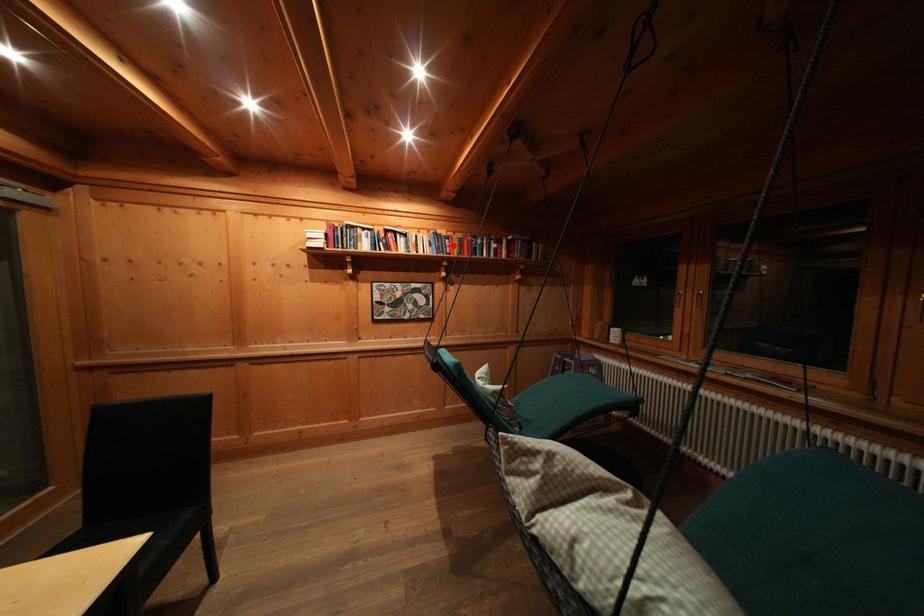
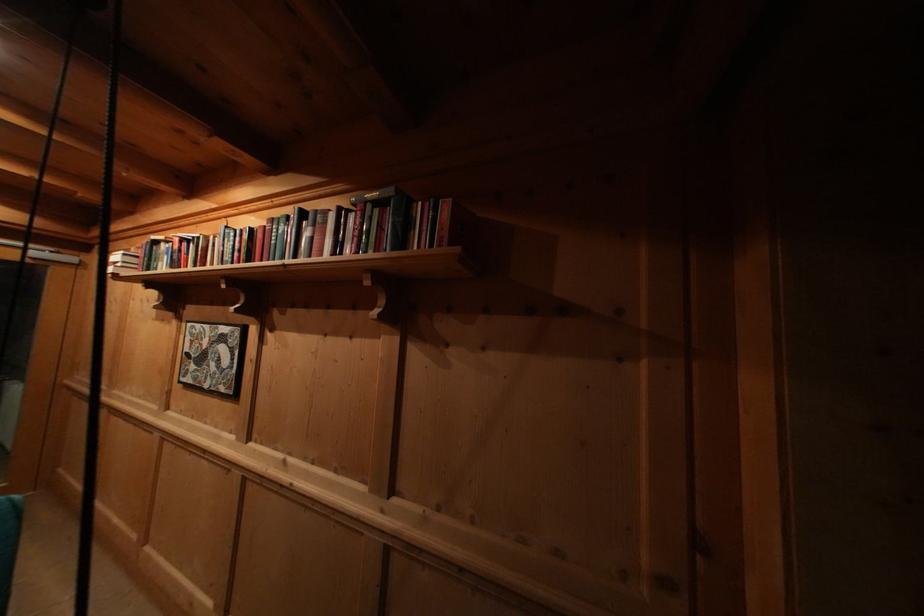
Find the pixel in the second image that matches the highlighted location in the first image.

(244, 245)